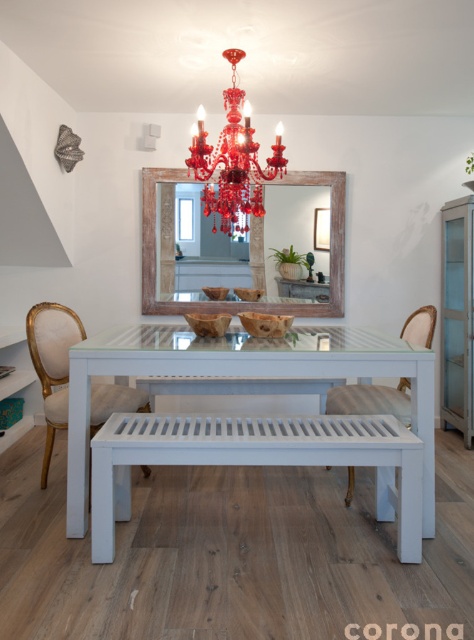
Does white painted wood table at center have a larger size compared to rustic wood mirror at center?

Yes, white painted wood table at center is bigger than rustic wood mirror at center.

Looking at this image, is white painted wood table at center wider than rustic wood mirror at center?

Correct, the width of white painted wood table at center exceeds that of rustic wood mirror at center.

Is point (345, 339) less distant than point (249, 225)?

That is True.

At what (x,y) coordinates should I click in order to perform the action: click on white painted wood table at center. Please return your answer as a coordinate pair (x, y). Image resolution: width=474 pixels, height=640 pixels. Looking at the image, I should click on (243, 376).

Who is taller, shiny crystal chandelier at upper center or matte white chair at center?

shiny crystal chandelier at upper center is taller.

Looking at this image, which is more to the right, shiny crystal chandelier at upper center or matte white chair at center?

Positioned to the right is matte white chair at center.

Who is more distant from viewer, (279,138) or (373,387)?

The point (373,387) is more distant.

The image size is (474, 640). In order to click on shiny crystal chandelier at upper center in this screenshot , I will do `click(233, 161)`.

Is rustic wood mirror at center taller than shiny crystal chandelier at upper center?

Indeed, rustic wood mirror at center has a greater height compared to shiny crystal chandelier at upper center.

Does rustic wood mirror at center have a greater width compared to shiny crystal chandelier at upper center?

Yes, rustic wood mirror at center is wider than shiny crystal chandelier at upper center.

Describe the element at coordinates (229, 300) in the screenshot. The width and height of the screenshot is (474, 640). I see `rustic wood mirror at center` at that location.

Locate an element on the screen. This screenshot has height=640, width=474. rustic wood mirror at center is located at coordinates (229, 300).